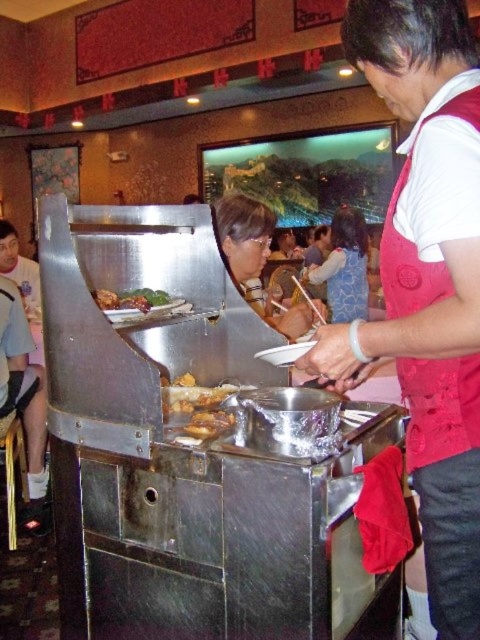
Is red apron waiter at right further to camera compared to shiny brown meat at center?

No, it is not.

Is red apron waiter at right shorter than shiny brown meat at center?

Incorrect, red apron waiter at right's height does not fall short of shiny brown meat at center's.

In the scene shown: Who is more forward, (435, 284) or (100, 308)?

Point (435, 284) is more forward.

Where is `red apron waiter at right`? The image size is (480, 640). red apron waiter at right is located at coordinates (427, 280).

Where is `red apron waiter at right`? The image size is (480, 640). red apron waiter at right is located at coordinates (427, 280).

Who is higher up, red apron waiter at right or matte black hair at center?

Positioned higher is matte black hair at center.

You are a GUI agent. You are given a task and a screenshot of the screen. Output one action in this format:
    pyautogui.click(x=<x>, y=<y>)
    Task: Click on the red apron waiter at right
    
    Given the screenshot: What is the action you would take?
    pyautogui.click(x=427, y=280)

Which is more to the right, golden-brown crispy chicken at center or matte black shirt at center?

golden-brown crispy chicken at center

Between golden-brown crispy chicken at center and matte black shirt at center, which one is positioned lower?

golden-brown crispy chicken at center is lower down.

Between point (232, 396) and point (7, 252), which one is positioned behind?

Point (7, 252)

Locate an element on the screen. The height and width of the screenshot is (640, 480). golden-brown crispy chicken at center is located at coordinates (200, 410).